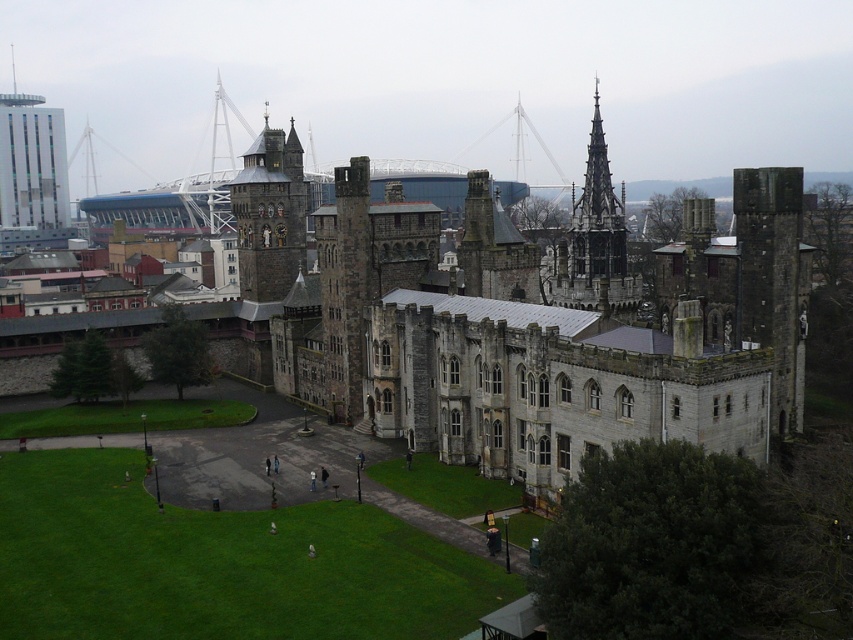
You are an architect evaluating the height of the buildings in the image. Which of the two buildings, the gray stone castle at center or the matte glass skyscraper at upper left, is taller?

The matte glass skyscraper at upper left is taller than the gray stone castle at center according to the description.

You are standing in the courtyard of the historic castle and want to take a photo that includes both the castle and the matte glass skyscraper at upper left. Based on their positions, which direction should you face to capture both in the frame?

The matte glass skyscraper at upper left is located at point (x=32, y=173), so you should face towards the upper left direction to include both the castle and the matte glass skyscraper at upper left in your photo.